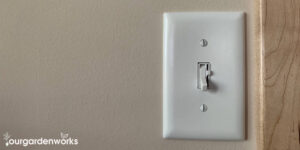
Locate an element on the screen. This screenshot has height=150, width=300. switch is located at coordinates [204, 87].